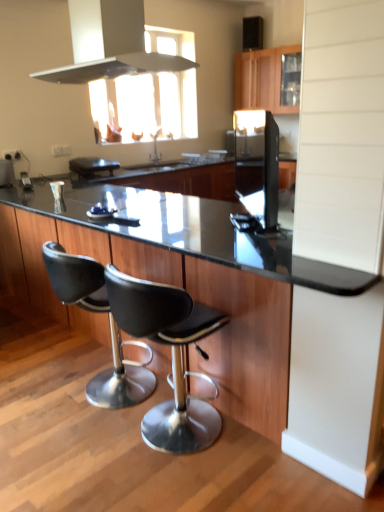
Find the location of `free space in front of black leather stool at center, positioned as the second chair in right-to-left order`. free space in front of black leather stool at center, positioned as the second chair in right-to-left order is located at coordinates (63, 463).